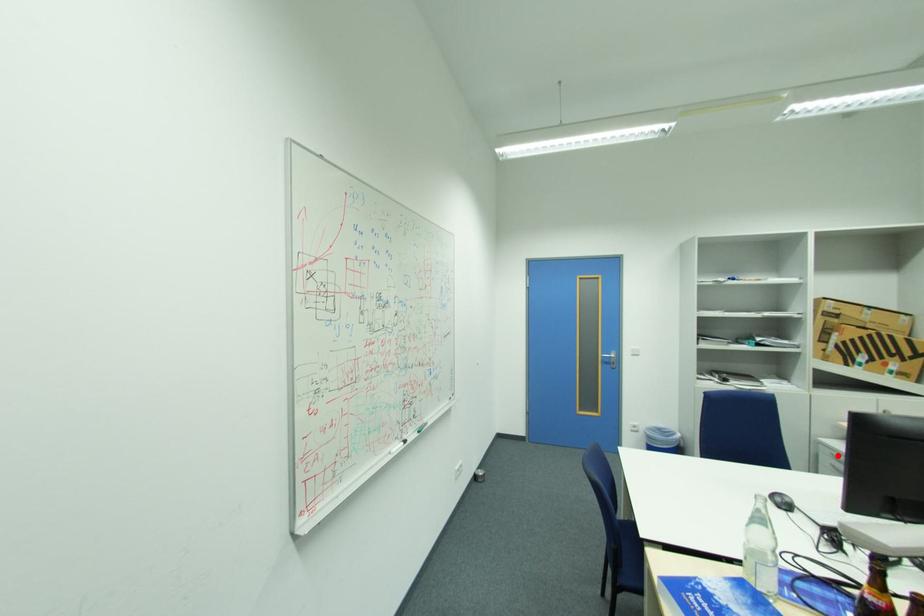
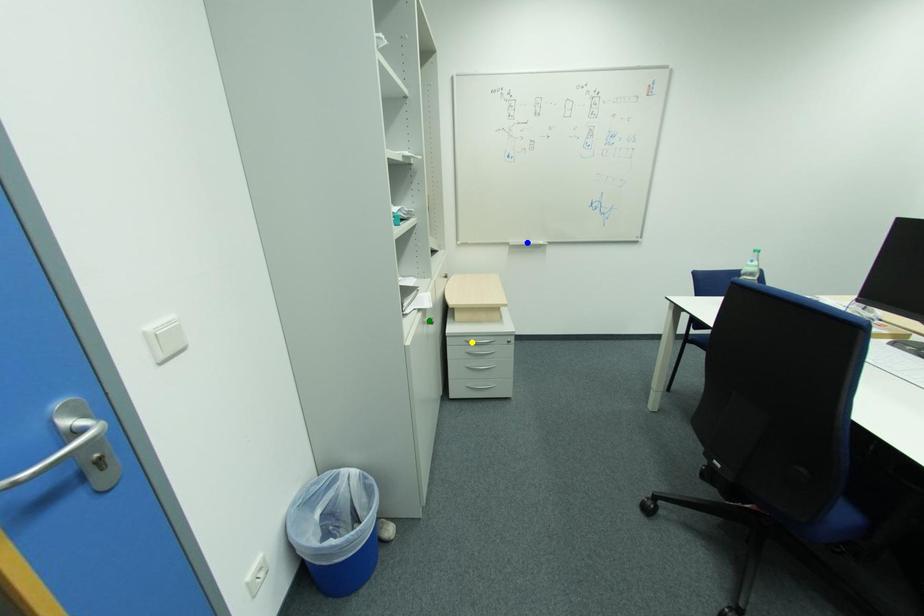
Question: I am providing you with two images of the same scene from different viewpoints. A red point is marked on the first image. You are given multiple points on the second image. Which point in image 2 represents the same 3d spot as the red point in image 1?

Choices:
 (A) blue point
 (B) green point
 (C) yellow point

Answer: (C)